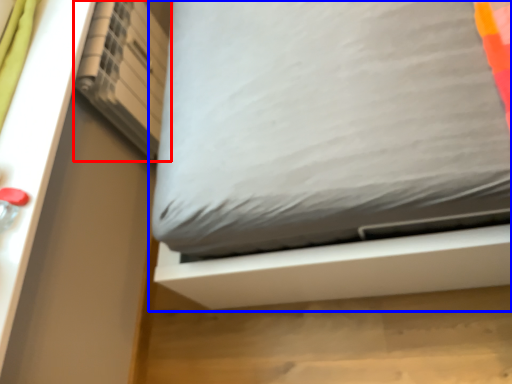
Question: Which object is closer to the camera taking this photo, shelf (highlighted by a red box) or bed (highlighted by a blue box)?

Choices:
 (A) shelf
 (B) bed

Answer: (B)